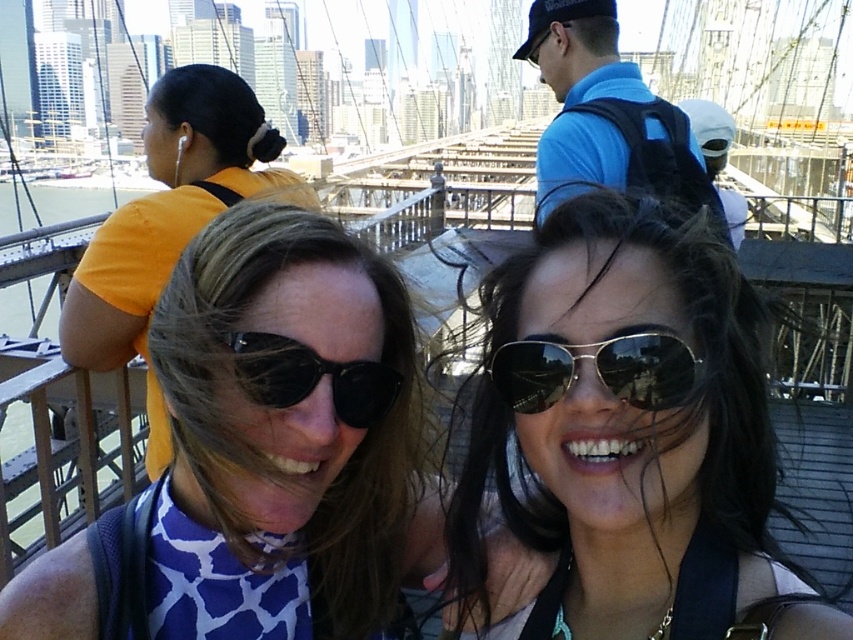
You are a photographer trying to capture a closeup of the sunglasses worn by the two people on the Brooklyn Bridge. Given that the shiny black sunglasses at center and the black reflective sunglasses at center are both at the center, which pair is positioned higher?

The shiny black sunglasses at center is positioned higher because it is much taller than the black reflective sunglasses at center.

You are standing at the point with coordinates (283, 429) on the Brooklyn Bridge. Which object is directly beneath you?

The point at (283, 429) is on the blue printed shirt at center, so the blue printed shirt at center is directly beneath you.

You are a photographer trying to capture a closeup of the sunglasses worn by the person on the left. Given that the shiny black sunglasses at center are under the black reflective sunglasses at center, which pair should you focus on to ensure you capture the correct subject?

The shiny black sunglasses at center is positioned under the black reflective sunglasses at center, so to capture the sunglasses worn by the person on the left, focus on the shiny black sunglasses at center since it is located below the other pair.